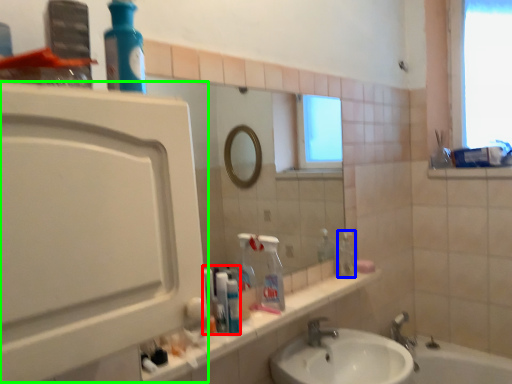
Question: Which object is positioned closest to toiletry (highlighted by a red box)? Select from bottle (highlighted by a blue box) and screen door (highlighted by a green box).

Choices:
 (A) bottle
 (B) screen door

Answer: (A)